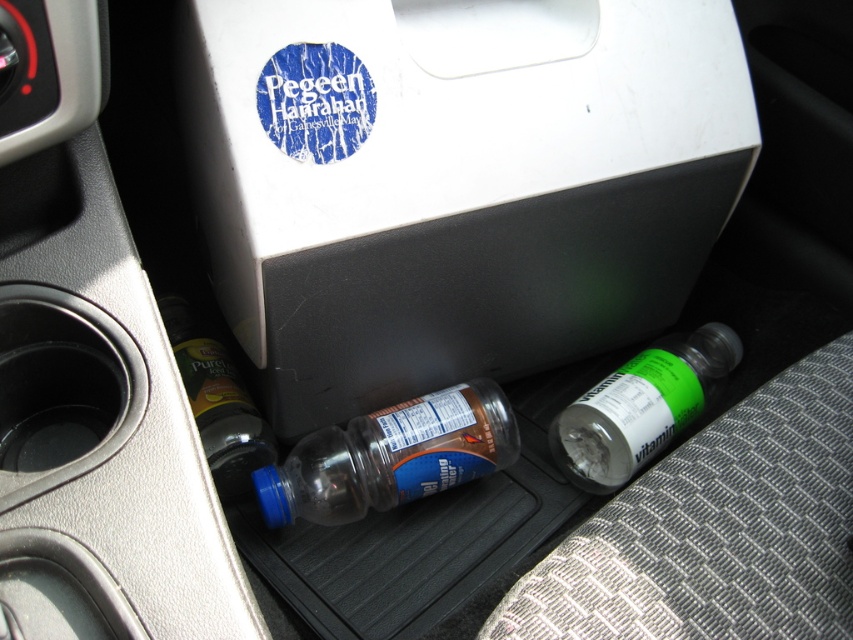
Question: Which point is farther to the camera?

Choices:
 (A) (296, 16)
 (B) (722, 362)
 (C) (436, 419)
 (D) (221, 419)

Answer: (B)

Question: Can you confirm if transparent plastic bottle at center is positioned below green translucent bottle at lower right?

Choices:
 (A) no
 (B) yes

Answer: (B)

Question: Which of the following is the closest to the observer?

Choices:
 (A) (489, 33)
 (B) (456, 444)

Answer: (A)

Question: Does white matte box at center appear on the left side of green translucent bottle at lower right?

Choices:
 (A) yes
 (B) no

Answer: (A)

Question: Is transparent plastic bottle at center further to the viewer compared to translucent plastic bottle at lower left?

Choices:
 (A) no
 (B) yes

Answer: (A)

Question: Which object is the closest to the transparent plastic bottle at center?

Choices:
 (A) translucent plastic bottle at lower left
 (B) green translucent bottle at lower right

Answer: (A)